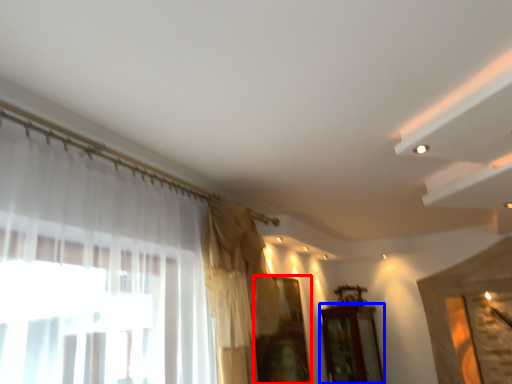
Question: Which object appears farthest to the camera in this image, window (highlighted by a red box) or furniture (highlighted by a blue box)?

Choices:
 (A) window
 (B) furniture

Answer: (B)